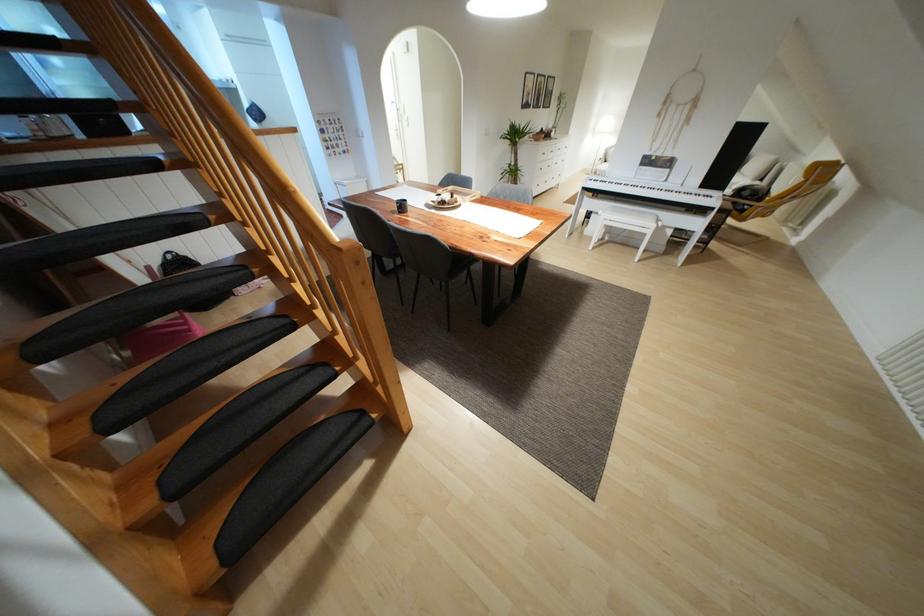
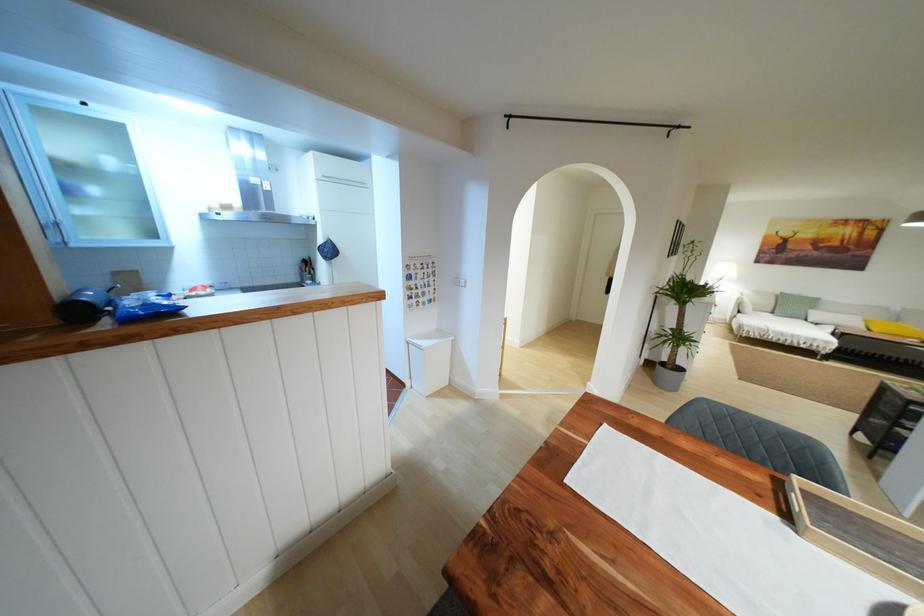
Where in the second image is the point corresponding to (358,134) from the first image?

(456, 282)